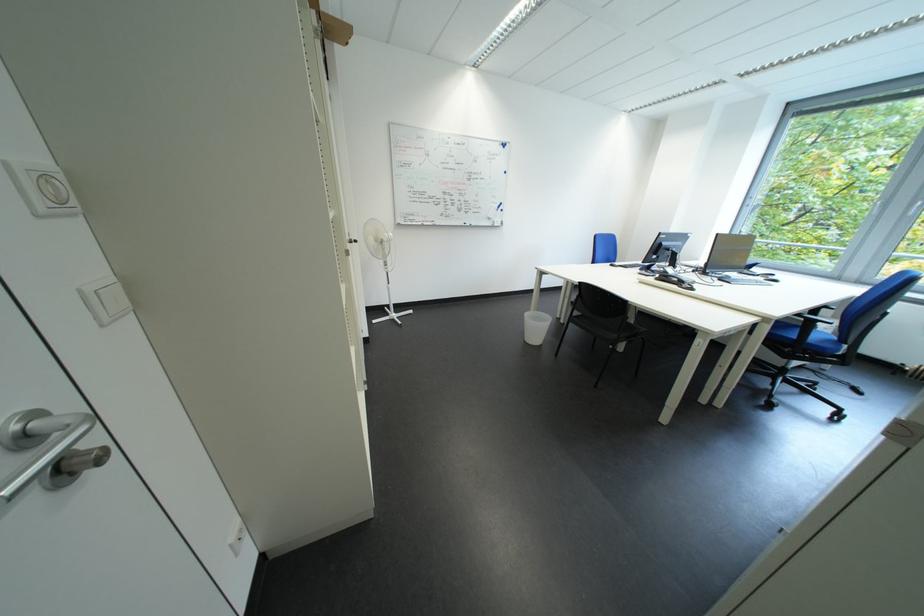
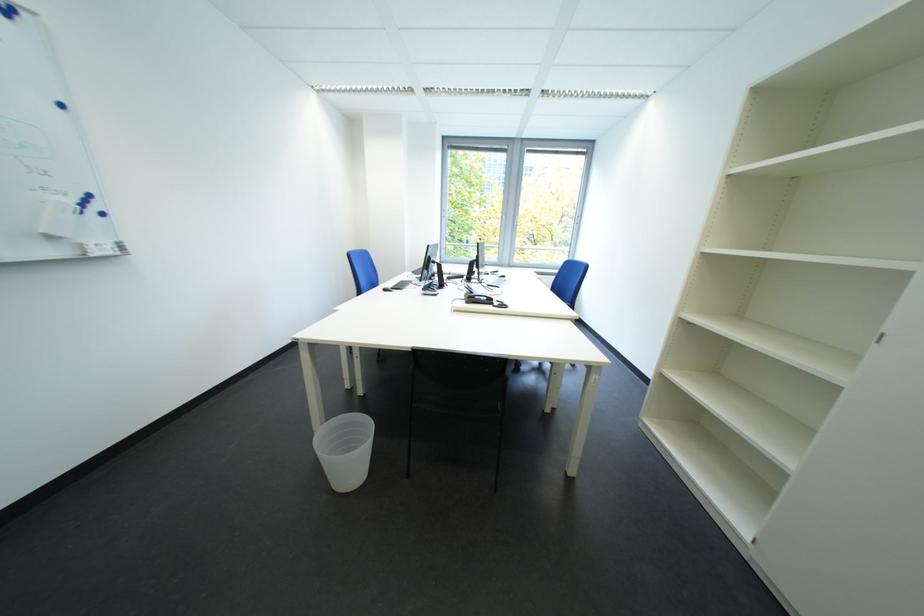
Where in the second image is the point corresponding to point 507,227 from the first image?

(108, 256)